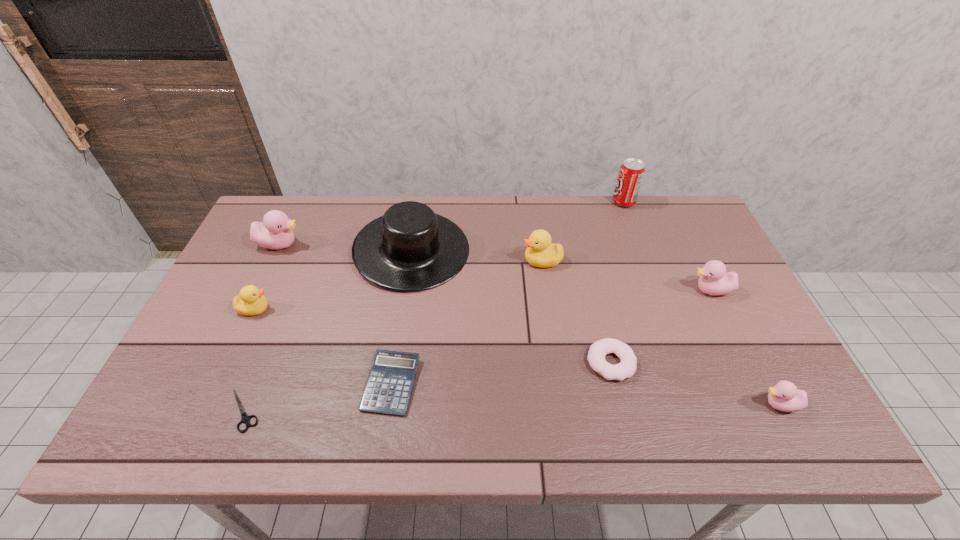
I want to click on object that is at the far left corner, so click(x=275, y=232).

Where is `object that is at the near left corner`? The width and height of the screenshot is (960, 540). object that is at the near left corner is located at coordinates (245, 418).

Where is `object that is at the near right corner`? object that is at the near right corner is located at coordinates 784,396.

Find the location of a particular element. free space at the far edge of the desktop is located at coordinates (353, 202).

At what (x,y) coordinates should I click in order to perform the action: click on vacant space at the near edge. Please return your answer as a coordinate pair (x, y). The width and height of the screenshot is (960, 540). Looking at the image, I should click on (686, 443).

At what (x,y) coordinates should I click in order to perform the action: click on vacant point at the right edge. Please return your answer as a coordinate pair (x, y). The width and height of the screenshot is (960, 540). Looking at the image, I should click on (756, 354).

Identify the location of free space between the third object from right to left and the calculator. (508, 293).

Identify the location of vacant space that is in between the farthest pink duckling and the eighth tallest object. (445, 303).

This screenshot has height=540, width=960. What are the coordinates of `blank region between the bigger yellow duckling and the ninth tallest object` in the screenshot? It's located at (467, 322).

This screenshot has height=540, width=960. I want to click on vacant space that's between the dress hat and the smallest pink duckling, so click(595, 328).